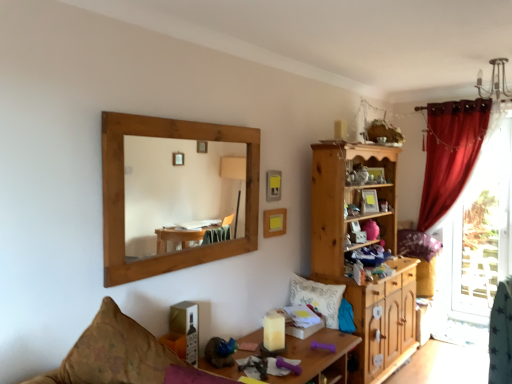
Question: From the image's perspective, would you say patterned fabric couch at lower left is shown under matte yellow picture frame at upper center, the first picture frame in the top-to-bottom sequence?

Choices:
 (A) no
 (B) yes

Answer: (B)

Question: Is patterned fabric couch at lower left closer to camera compared to matte yellow picture frame at upper center, which appears as the second picture frame when ordered from the bottom?

Choices:
 (A) yes
 (B) no

Answer: (A)

Question: Can you confirm if patterned fabric couch at lower left is positioned to the right of matte yellow picture frame at upper center, the first picture frame in the top-to-bottom sequence?

Choices:
 (A) yes
 (B) no

Answer: (B)

Question: Can you confirm if patterned fabric couch at lower left is shorter than matte yellow picture frame at upper center, which appears as the second picture frame when ordered from the bottom?

Choices:
 (A) no
 (B) yes

Answer: (A)

Question: Would you say patterned fabric couch at lower left is a long distance from matte yellow picture frame at upper center, which appears as the second picture frame when ordered from the bottom?

Choices:
 (A) no
 (B) yes

Answer: (B)

Question: In the image, is yellow matte picture frame at upper center, which appears as the 1th picture frame when ordered from the bottom, on the left side or the right side of wooden cabinet at center-right?

Choices:
 (A) right
 (B) left

Answer: (B)

Question: Is yellow matte picture frame at upper center, which appears as the 1th picture frame when ordered from the bottom, bigger or smaller than wooden cabinet at center-right?

Choices:
 (A) small
 (B) big

Answer: (A)

Question: From the image's perspective, is yellow matte picture frame at upper center, which appears as the 1th picture frame when ordered from the bottom, positioned above or below wooden cabinet at center-right?

Choices:
 (A) below
 (B) above

Answer: (B)

Question: Would you say yellow matte picture frame at upper center, which appears as the 1th picture frame when ordered from the bottom, is inside or outside wooden cabinet at center-right?

Choices:
 (A) inside
 (B) outside

Answer: (B)

Question: Considering the relative positions of white mesh screen at right and wooden cabinet at center-right in the image provided, is white mesh screen at right to the left or to the right of wooden cabinet at center-right?

Choices:
 (A) right
 (B) left

Answer: (A)

Question: Does point (482, 233) appear closer or farther from the camera than point (342, 172)?

Choices:
 (A) closer
 (B) farther

Answer: (B)

Question: Considering the positions of white mesh screen at right and wooden cabinet at center-right in the image, is white mesh screen at right wider or thinner than wooden cabinet at center-right?

Choices:
 (A) thin
 (B) wide

Answer: (A)

Question: Looking at the image, does white mesh screen at right seem bigger or smaller compared to wooden cabinet at center-right?

Choices:
 (A) small
 (B) big

Answer: (A)

Question: Considering their positions, is wooden desk at center located in front of or behind yellow matte picture frame at upper center, which appears as the 1th picture frame when ordered from the bottom?

Choices:
 (A) behind
 (B) front

Answer: (B)

Question: Considering the relative positions of wooden desk at center and yellow matte picture frame at upper center, placed as the second picture frame when sorted from top to bottom, in the image provided, is wooden desk at center to the left or to the right of yellow matte picture frame at upper center, placed as the second picture frame when sorted from top to bottom,?

Choices:
 (A) right
 (B) left

Answer: (B)